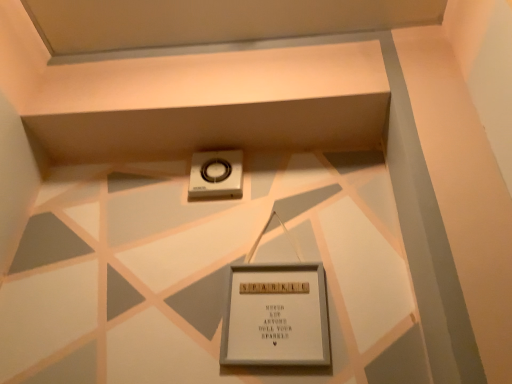
Question: From a real-world perspective, does white wooden picture frame at center stand above silver metallic scale at center?

Choices:
 (A) yes
 (B) no

Answer: (B)

Question: From the image's perspective, would you say white wooden picture frame at center is shown under silver metallic scale at center?

Choices:
 (A) no
 (B) yes

Answer: (B)

Question: Is white wooden picture frame at center shorter than silver metallic scale at center?

Choices:
 (A) yes
 (B) no

Answer: (B)

Question: Does white wooden picture frame at center have a larger size compared to silver metallic scale at center?

Choices:
 (A) yes
 (B) no

Answer: (A)

Question: From the image's perspective, does white wooden picture frame at center appear higher than silver metallic scale at center?

Choices:
 (A) yes
 (B) no

Answer: (B)

Question: Can you confirm if white wooden picture frame at center is taller than silver metallic scale at center?

Choices:
 (A) yes
 (B) no

Answer: (A)

Question: Is white wooden picture frame at center surrounded by silver metallic scale at center?

Choices:
 (A) no
 (B) yes

Answer: (A)

Question: Is silver metallic scale at center to the left of white wooden picture frame at center from the viewer's perspective?

Choices:
 (A) yes
 (B) no

Answer: (A)

Question: From a real-world perspective, is silver metallic scale at center over white wooden picture frame at center?

Choices:
 (A) yes
 (B) no

Answer: (A)

Question: Is silver metallic scale at center facing towards white wooden picture frame at center?

Choices:
 (A) no
 (B) yes

Answer: (A)

Question: Can you confirm if silver metallic scale at center is positioned to the right of white wooden picture frame at center?

Choices:
 (A) yes
 (B) no

Answer: (B)

Question: Is silver metallic scale at center thinner than white wooden picture frame at center?

Choices:
 (A) no
 (B) yes

Answer: (A)

Question: Looking at their shapes, would you say silver metallic scale at center is wider or thinner than white wooden picture frame at center?

Choices:
 (A) wide
 (B) thin

Answer: (A)